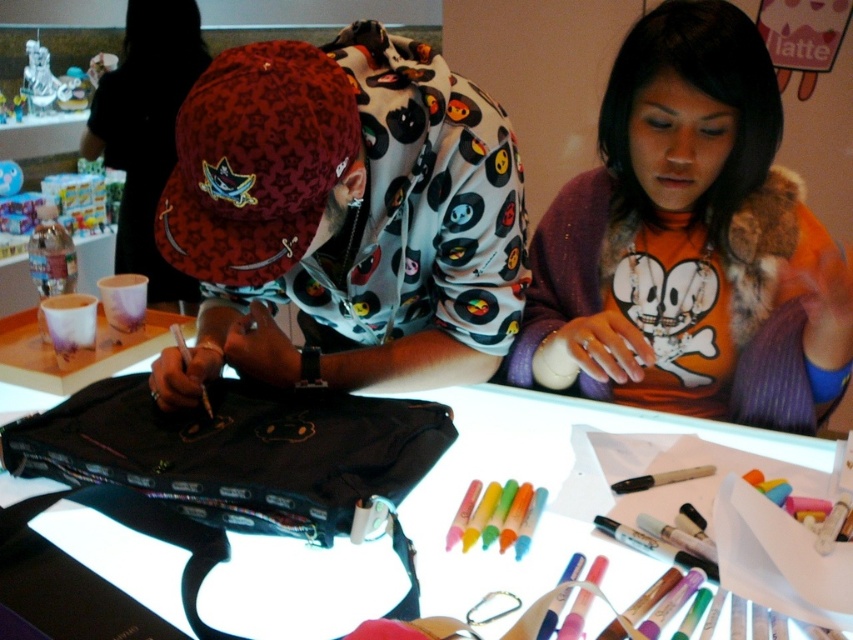
Question: Which of the following is the closest to the observer?

Choices:
 (A) pyautogui.click(x=125, y=268)
 (B) pyautogui.click(x=74, y=541)
 (C) pyautogui.click(x=633, y=209)

Answer: (B)

Question: Is white paper at center closer to the viewer compared to matte red cap at upper left?

Choices:
 (A) yes
 (B) no

Answer: (A)

Question: Estimate the real-world distances between objects in this image. Which object is closer to the white paper at center?

Choices:
 (A) matte red cap at upper left
 (B) orange fabric shirt at center

Answer: (B)

Question: Which point appears farthest from the camera in this image?

Choices:
 (A) (618, 557)
 (B) (154, 156)

Answer: (B)

Question: Does white paper at center appear under matte red cap at upper left?

Choices:
 (A) no
 (B) yes

Answer: (B)

Question: Is white paper at center further to camera compared to matte red cap at upper left?

Choices:
 (A) yes
 (B) no

Answer: (B)